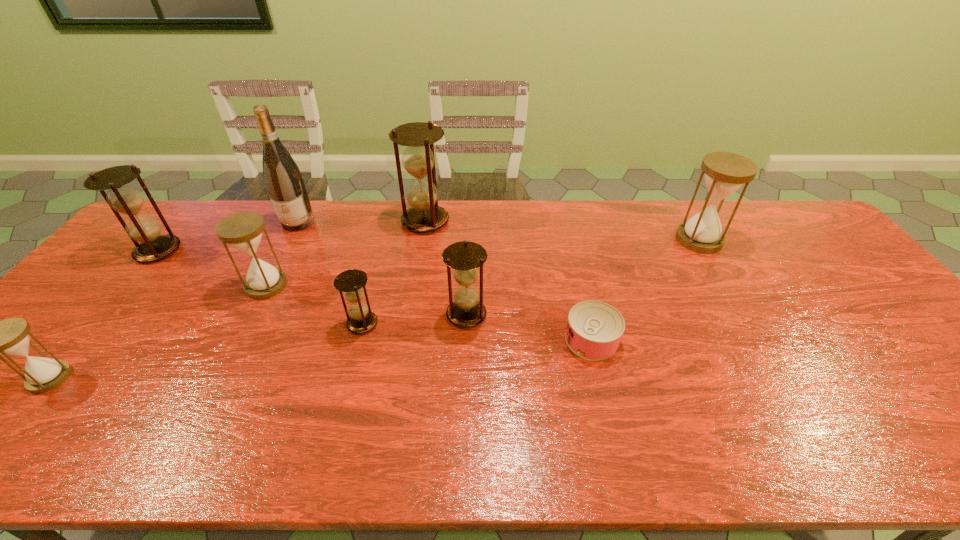
This screenshot has height=540, width=960. Find the location of `the third biggest brown hourglass`. the third biggest brown hourglass is located at coordinates (466, 310).

Identify the location of the seventh object from left to right. The image size is (960, 540). (466, 310).

Where is `the fifth object from right to left`? the fifth object from right to left is located at coordinates (352, 282).

Where is `the smallest brown hourglass`? the smallest brown hourglass is located at coordinates (352, 282).

This screenshot has height=540, width=960. I want to click on the nearest hourglass, so click(11, 337).

Locate an element on the screen. the nearest white hourglass is located at coordinates (11, 337).

At what (x,y) coordinates should I click in order to perform the action: click on the shortest object. Please return your answer as a coordinate pair (x, y). Looking at the image, I should click on (594, 329).

The width and height of the screenshot is (960, 540). I want to click on can, so click(594, 329).

Locate an element on the screen. vacant space located 0.360m on the label of the wine bottle is located at coordinates (252, 314).

Identify the location of free region located 0.270m on the front of the fifth hourglass from left to right. The width and height of the screenshot is (960, 540). (414, 295).